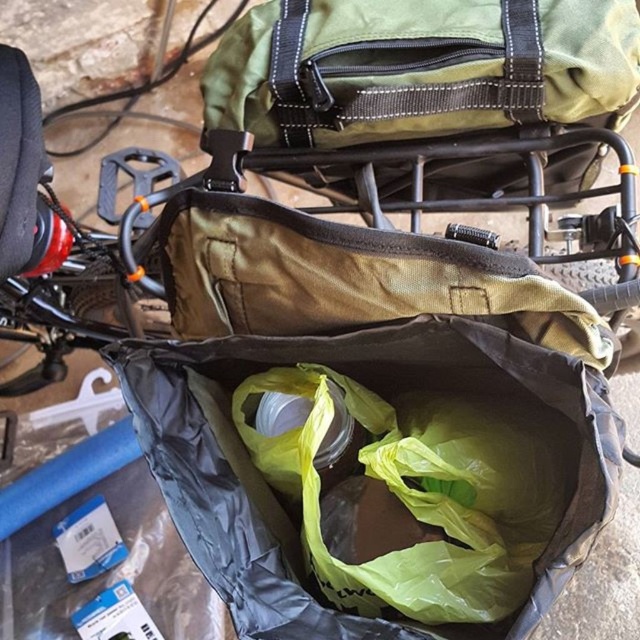
Which of these two, matte brown fabric bag at center or matte green fabric baby carriage at upper center, stands taller?

Standing taller between the two is matte green fabric baby carriage at upper center.

Between point (573, 403) and point (285, 148), which one is positioned in front?

Point (573, 403)

Image resolution: width=640 pixels, height=640 pixels. Find the location of `matte brown fabric bag at center`. matte brown fabric bag at center is located at coordinates (360, 387).